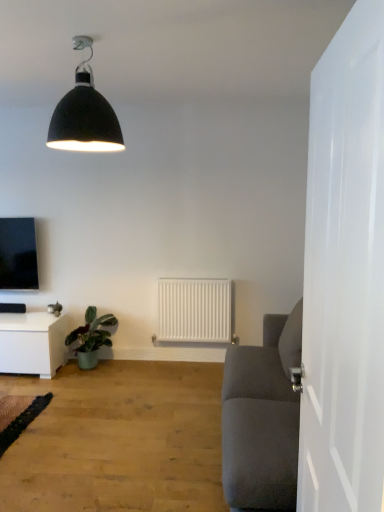
Question: Is white matte radiator at center touching matte black tv at upper left?

Choices:
 (A) yes
 (B) no

Answer: (B)

Question: Considering the relative positions of white matte radiator at center and matte black tv at upper left in the image provided, is white matte radiator at center to the left of matte black tv at upper left from the viewer's perspective?

Choices:
 (A) no
 (B) yes

Answer: (A)

Question: Is white matte radiator at center wider than matte black tv at upper left?

Choices:
 (A) no
 (B) yes

Answer: (A)

Question: Could you tell me if white matte radiator at center is turned towards matte black tv at upper left?

Choices:
 (A) yes
 (B) no

Answer: (B)

Question: Is white matte radiator at center positioned before matte black tv at upper left?

Choices:
 (A) yes
 (B) no

Answer: (A)

Question: Does white matte radiator at center have a lesser height compared to matte black tv at upper left?

Choices:
 (A) no
 (B) yes

Answer: (B)

Question: Could you tell me if matte black lampshade at upper center is facing green glossy plant at lower left?

Choices:
 (A) no
 (B) yes

Answer: (A)

Question: Does matte black lampshade at upper center have a lesser width compared to green glossy plant at lower left?

Choices:
 (A) no
 (B) yes

Answer: (B)

Question: Is matte black lampshade at upper center next to green glossy plant at lower left and touching it?

Choices:
 (A) yes
 (B) no

Answer: (B)

Question: Can you confirm if matte black lampshade at upper center is wider than green glossy plant at lower left?

Choices:
 (A) no
 (B) yes

Answer: (A)

Question: Is matte black lampshade at upper center positioned in front of green glossy plant at lower left?

Choices:
 (A) yes
 (B) no

Answer: (A)

Question: Would you consider matte black lampshade at upper center to be distant from green glossy plant at lower left?

Choices:
 (A) no
 (B) yes

Answer: (B)

Question: Is white matte radiator at center to the left of green glossy plant at lower left from the viewer's perspective?

Choices:
 (A) yes
 (B) no

Answer: (B)